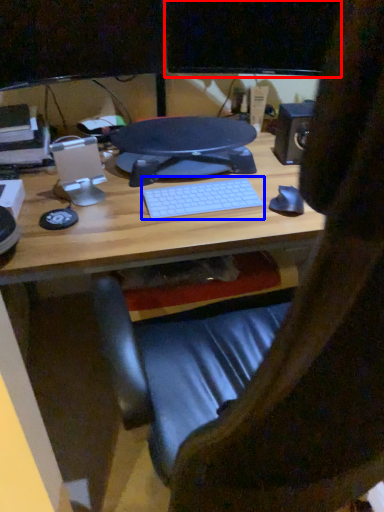
Question: Which point is further to the camera, computer monitor (highlighted by a red box) or computer keyboard (highlighted by a blue box)?

Choices:
 (A) computer monitor
 (B) computer keyboard

Answer: (A)